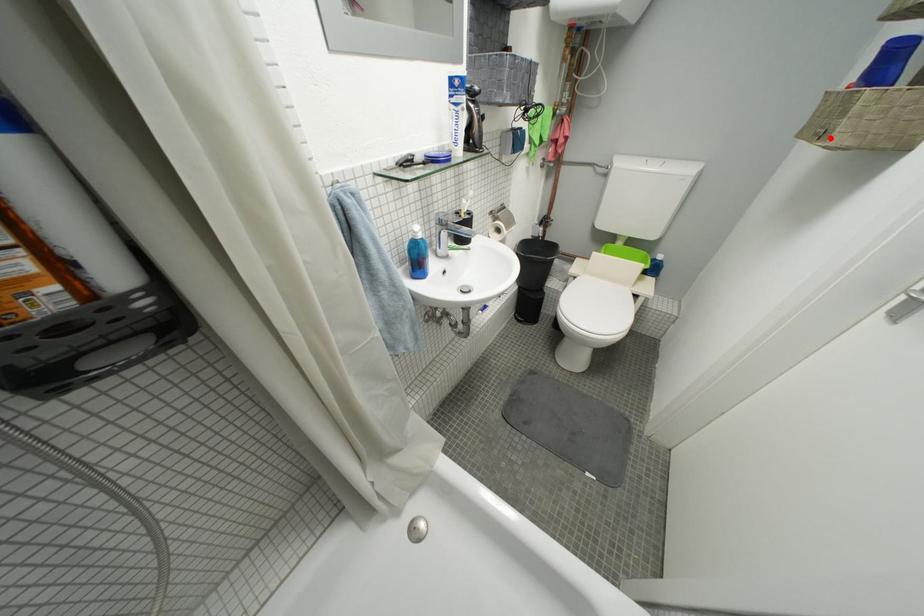
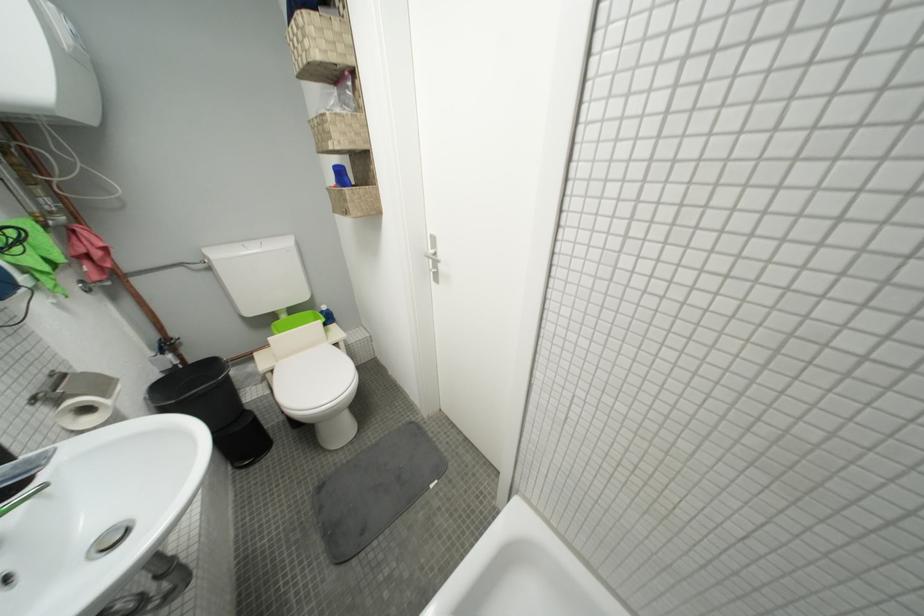
Question: I am providing you with two images of the same scene from different viewpoints. In image1, a red point is highlighted. Considering the same 3D point in image2, which of the following is correct?

Choices:
 (A) It is closer
 (B) It is farther

Answer: (A)